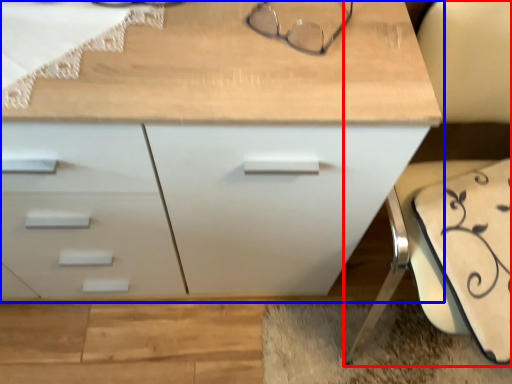
Question: Which point is further to the camera, swivel chair (highlighted by a red box) or chest of drawers (highlighted by a blue box)?

Choices:
 (A) swivel chair
 (B) chest of drawers

Answer: (B)